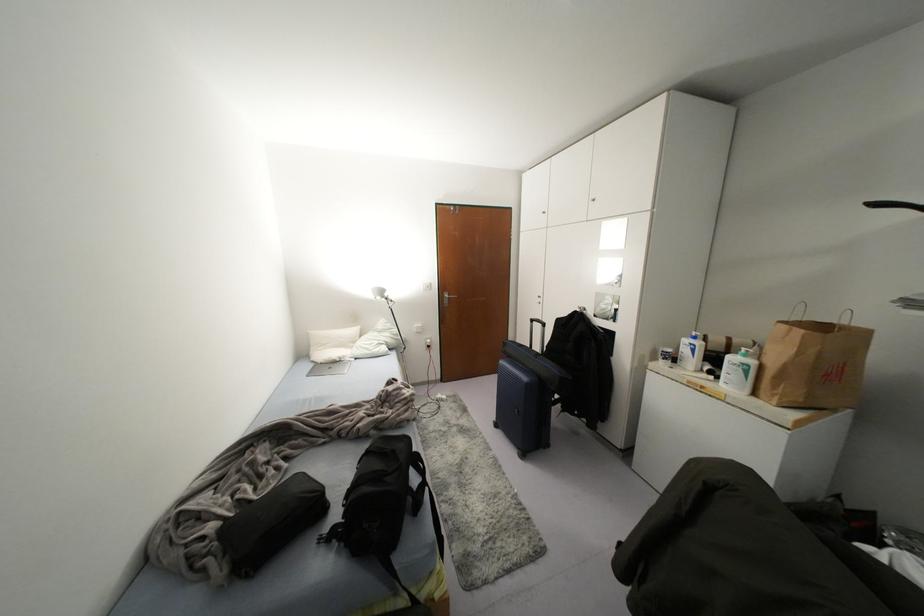
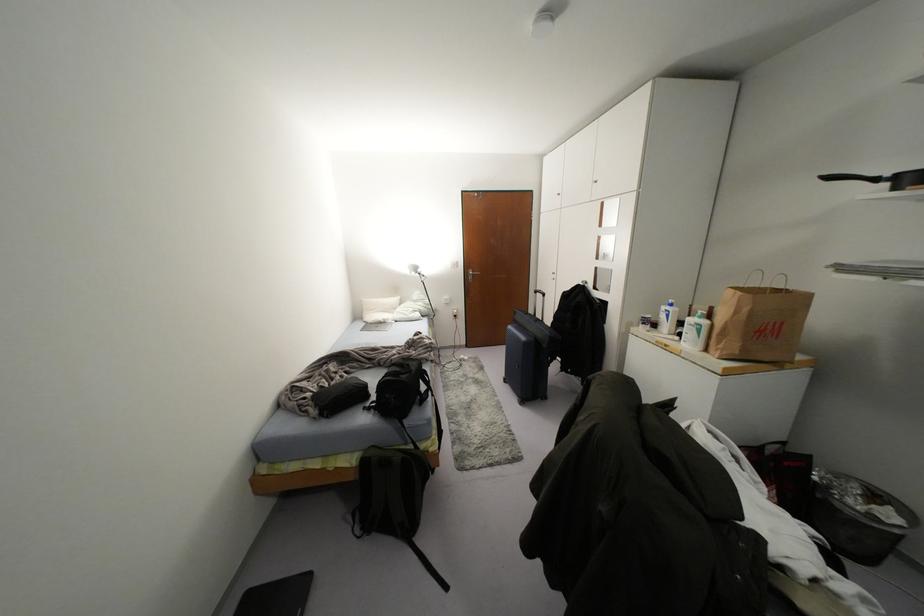
Where in the second image is the point corresponding to (751,362) from the first image?

(703, 322)